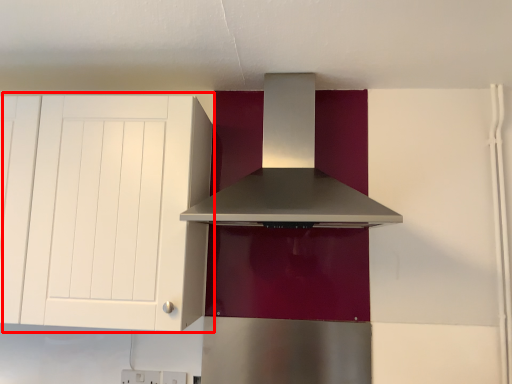
Question: From the image's perspective, where is cabinetry (annotated by the red box) located in relation to home appliance in the image?

Choices:
 (A) below
 (B) above

Answer: (A)